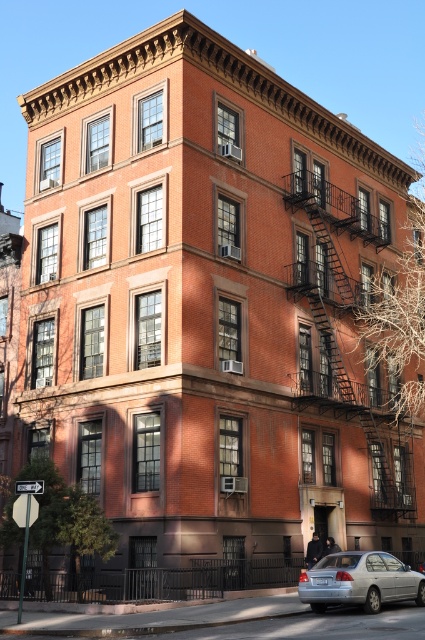
Does rustic metal fire escape at right have a greater width compared to silver metallic sedan at lower right?

Yes.

From the picture: Which is more to the left, rustic metal fire escape at right or silver metallic sedan at lower right?

silver metallic sedan at lower right is more to the left.

Locate an element on the screen. Image resolution: width=425 pixels, height=640 pixels. rustic metal fire escape at right is located at coordinates (348, 332).